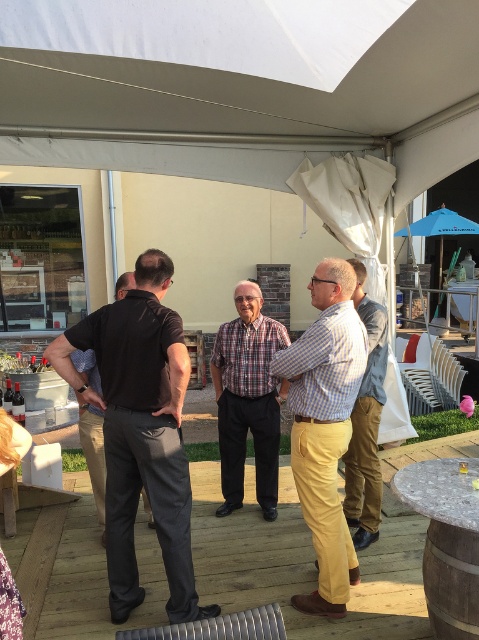
Question: Observing the image, what is the correct spatial positioning of dark gray pants at left in reference to plaid fabric shirt at center?

Choices:
 (A) left
 (B) right

Answer: (A)

Question: Which point appears closest to the camera in this image?

Choices:
 (A) (121, 593)
 (B) (88, 358)
 (C) (406, 234)

Answer: (A)

Question: Which object appears farthest from the camera in this image?

Choices:
 (A) blue fabric umbrella at upper right
 (B) black smooth shirt at center

Answer: (A)

Question: Which point is farther from the camera taking this photo?

Choices:
 (A) (238, 492)
 (B) (139, 596)
 (C) (369, 326)
 (D) (299, 488)

Answer: (A)

Question: Is checkered fabric shirt at center smaller than plaid fabric shirt at center?

Choices:
 (A) yes
 (B) no

Answer: (A)

Question: Can you confirm if checkered fabric shirt at center is positioned below plaid fabric shirt at center?

Choices:
 (A) yes
 (B) no

Answer: (A)